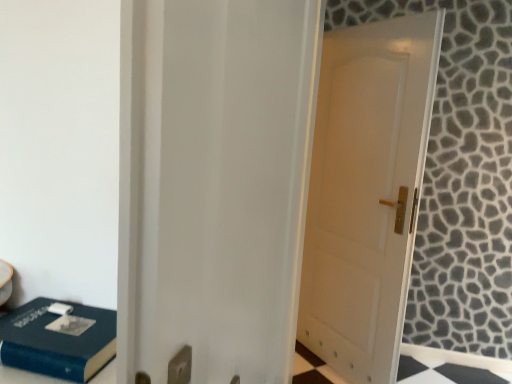
Question: From the image's perspective, relative to white glossy door at center, is blue matte book at lower left above or below?

Choices:
 (A) above
 (B) below

Answer: (B)

Question: Relative to white glossy door at center, is blue matte book at lower left in front or behind?

Choices:
 (A) front
 (B) behind

Answer: (B)

Question: Which is farther from the blue matte book at lower left?

Choices:
 (A) white matte door at center
 (B) white glossy door at center

Answer: (A)

Question: Which object is the closest to the white glossy door at center?

Choices:
 (A) blue matte book at lower left
 (B) white matte door at center

Answer: (A)